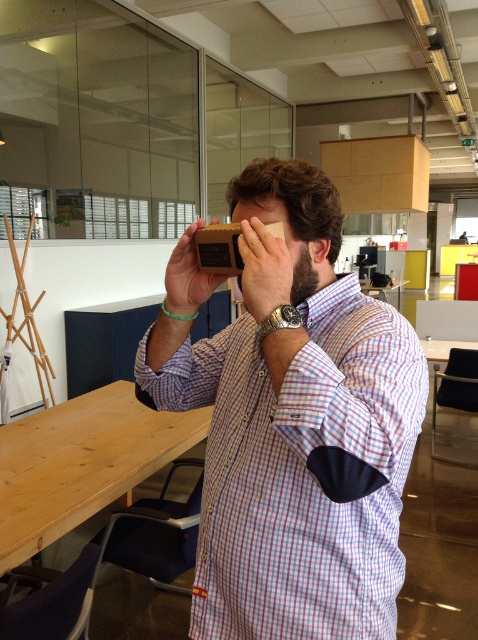
Question: Can you confirm if wooden block at center is smaller than wooden coaster at center?

Choices:
 (A) no
 (B) yes

Answer: (A)

Question: Is wooden table at lower left to the left of wooden coaster at center from the viewer's perspective?

Choices:
 (A) yes
 (B) no

Answer: (A)

Question: Which point appears farthest from the camera in this image?

Choices:
 (A) (378, 557)
 (B) (256, 182)

Answer: (B)

Question: Which is nearer to the wooden table at lower left?

Choices:
 (A) wooden coaster at center
 (B) matte brown wooden block at center
 (C) matte wooden box at center
 (D) wooden block at center

Answer: (C)

Question: Which object appears farthest from the camera in this image?

Choices:
 (A) wooden table at lower left
 (B) matte wooden box at center
 (C) wooden coaster at center
 (D) wooden block at center

Answer: (A)

Question: From the image, what is the correct spatial relationship of wooden table at lower left in relation to wooden block at center?

Choices:
 (A) left
 (B) right

Answer: (A)